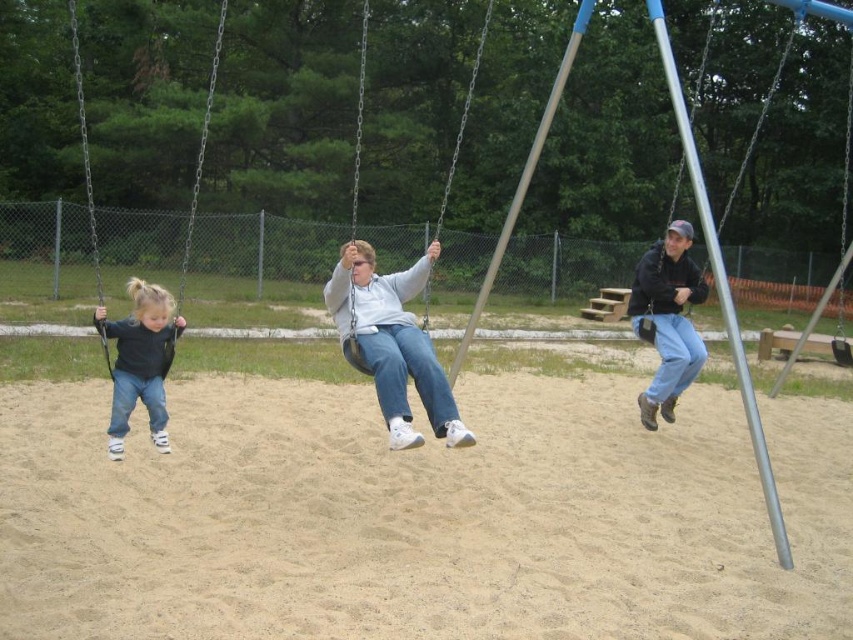
Is point (463, 544) in front of point (360, 40)?

Yes, it is in front of point (360, 40).

Who is lower down, light brown sandy ground at center or metallic silver swing at center?

light brown sandy ground at center is below.

Is point (498, 532) positioned behind point (364, 54)?

That is False.

The width and height of the screenshot is (853, 640). I want to click on light brown sandy ground at center, so click(421, 516).

Which of these two, black matte jacket at upper right or dark blue denim jeans at left, stands shorter?

With less height is black matte jacket at upper right.

Is point (677, 269) positioned in front of point (143, 372)?

No, it is not.

Locate an element on the screen. The image size is (853, 640). black matte jacket at upper right is located at coordinates (668, 320).

Is dark blue denim jeans at left to the right of metallic silver swing at center from the viewer's perspective?

No, dark blue denim jeans at left is not to the right of metallic silver swing at center.

Does dark blue denim jeans at left have a lesser height compared to metallic silver swing at center?

Indeed, dark blue denim jeans at left has a lesser height compared to metallic silver swing at center.

Is point (152, 419) positioned in front of point (350, 237)?

Yes, it is in front of point (350, 237).

This screenshot has width=853, height=640. I want to click on dark blue denim jeans at left, so click(140, 360).